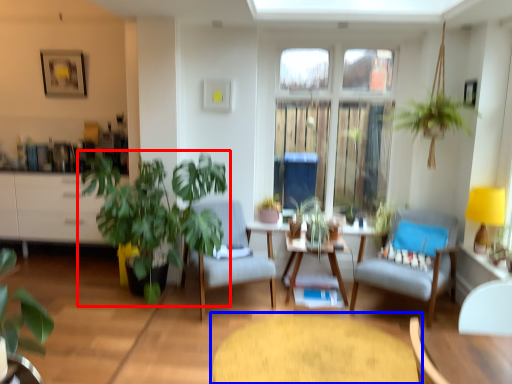
Question: Among these objects, which one is nearest to the camera, houseplant (highlighted by a red box) or coffee table (highlighted by a blue box)?

Choices:
 (A) houseplant
 (B) coffee table

Answer: (B)